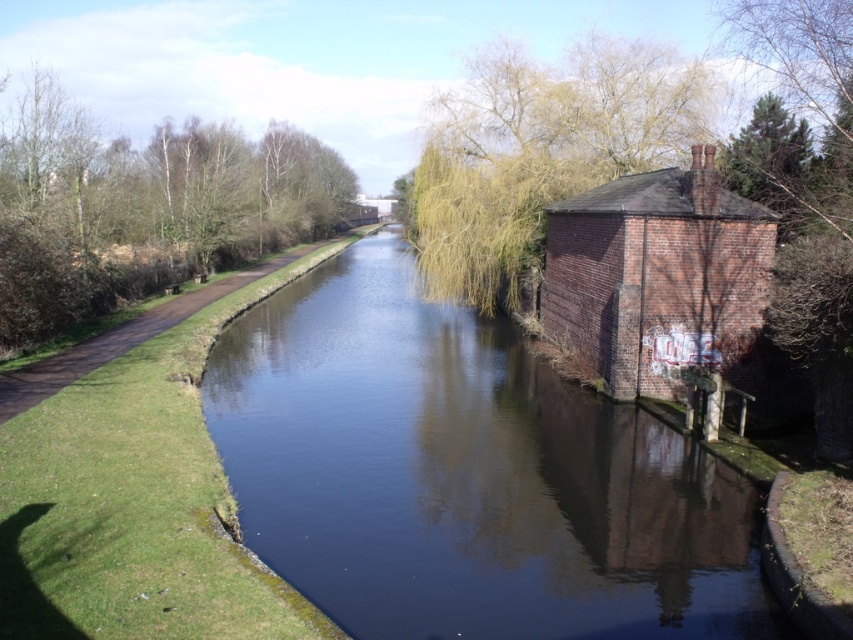
Question: Where is yellow-green leaves at upper center located in relation to brown dirt path at left in the image?

Choices:
 (A) below
 (B) above

Answer: (B)

Question: Where is brown leafy tree at upper left located in relation to brown dirt path at left in the image?

Choices:
 (A) above
 (B) below

Answer: (A)

Question: Among these objects, which one is nearest to the camera?

Choices:
 (A) brown leafy tree at upper left
 (B) dark blue water at center
 (C) yellow-green leaves at upper center

Answer: (B)

Question: Which object appears closest to the camera in this image?

Choices:
 (A) brown leafy tree at upper left
 (B) yellow-green leaves at upper center
 (C) brown dirt path at left
 (D) green leafy tree at right

Answer: (D)

Question: Among these points, which one is farthest from the camera?

Choices:
 (A) (473, 131)
 (B) (218, 228)
 (C) (9, 417)

Answer: (B)

Question: Can you confirm if dark blue water at center is positioned below yellow-green leaves at upper center?

Choices:
 (A) yes
 (B) no

Answer: (A)